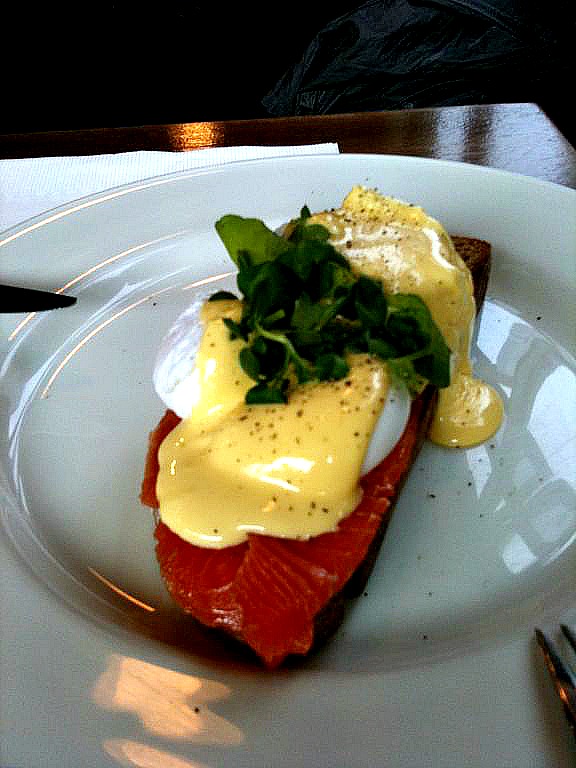
Find the location of a particular element. This screenshot has height=768, width=576. white plate is located at coordinates (535, 275).